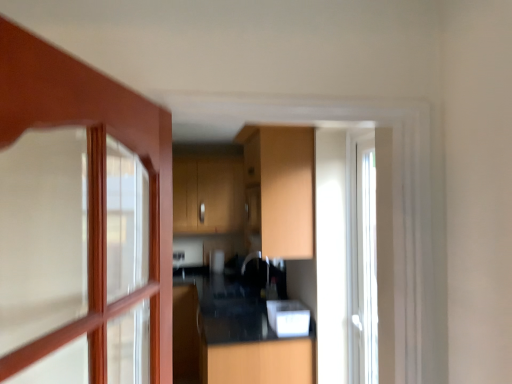
Question: Is black glossy counter top at center taller than matte wood cabinet at center?

Choices:
 (A) no
 (B) yes

Answer: (B)

Question: From the image's perspective, is black glossy counter top at center on matte wood cabinet at center?

Choices:
 (A) yes
 (B) no

Answer: (B)

Question: Considering the relative sizes of black glossy counter top at center and matte wood cabinet at center in the image provided, is black glossy counter top at center thinner than matte wood cabinet at center?

Choices:
 (A) no
 (B) yes

Answer: (A)

Question: From a real-world perspective, is black glossy counter top at center below matte wood cabinet at center?

Choices:
 (A) yes
 (B) no

Answer: (A)

Question: From the image's perspective, is black glossy counter top at center located beneath matte wood cabinet at center?

Choices:
 (A) yes
 (B) no

Answer: (A)

Question: Considering the positions of black glossy counter top at center and white glossy microwave at center in the image, is black glossy counter top at center wider or thinner than white glossy microwave at center?

Choices:
 (A) wide
 (B) thin

Answer: (A)

Question: Relative to white glossy microwave at center, is black glossy counter top at center in front or behind?

Choices:
 (A) front
 (B) behind

Answer: (A)

Question: In terms of height, does black glossy counter top at center look taller or shorter compared to white glossy microwave at center?

Choices:
 (A) tall
 (B) short

Answer: (A)

Question: Is point (185, 372) closer or farther from the camera than point (292, 302)?

Choices:
 (A) closer
 (B) farther

Answer: (B)

Question: Is matte wood cabinet at center situated inside white glossy microwave at center or outside?

Choices:
 (A) outside
 (B) inside

Answer: (A)

Question: Relative to white glossy microwave at center, is matte wood cabinet at center in front or behind?

Choices:
 (A) front
 (B) behind

Answer: (A)

Question: From a real-world perspective, relative to white glossy microwave at center, is matte wood cabinet at center vertically above or below?

Choices:
 (A) above
 (B) below

Answer: (A)

Question: Looking at the image, does matte wood cabinet at center seem bigger or smaller compared to white glossy microwave at center?

Choices:
 (A) small
 (B) big

Answer: (B)

Question: Is point (203, 364) closer or farther from the camera than point (288, 135)?

Choices:
 (A) closer
 (B) farther

Answer: (B)

Question: From the image's perspective, relative to matte wood cabinet at center, is black glossy counter top at center above or below?

Choices:
 (A) above
 (B) below

Answer: (B)